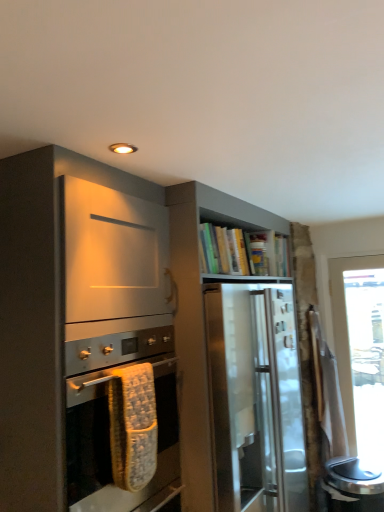
Question: From a real-world perspective, is matte silver oven at center positioned above or below satin wood cabinet at upper center?

Choices:
 (A) above
 (B) below

Answer: (A)

Question: From the image's perspective, is matte silver oven at center above or below satin wood cabinet at upper center?

Choices:
 (A) above
 (B) below

Answer: (A)

Question: In the image, is matte silver oven at center on the left side or the right side of satin wood cabinet at upper center?

Choices:
 (A) left
 (B) right

Answer: (A)

Question: In terms of height, does satin wood cabinet at upper center look taller or shorter compared to matte silver oven at center?

Choices:
 (A) short
 (B) tall

Answer: (B)

Question: Is point (188, 196) closer or farther from the camera than point (92, 475)?

Choices:
 (A) farther
 (B) closer

Answer: (A)

Question: Visually, is satin wood cabinet at upper center positioned to the left or to the right of matte silver oven at center?

Choices:
 (A) left
 (B) right

Answer: (B)

Question: From a real-world perspective, is satin wood cabinet at upper center physically located above or below matte silver oven at center?

Choices:
 (A) above
 (B) below

Answer: (B)